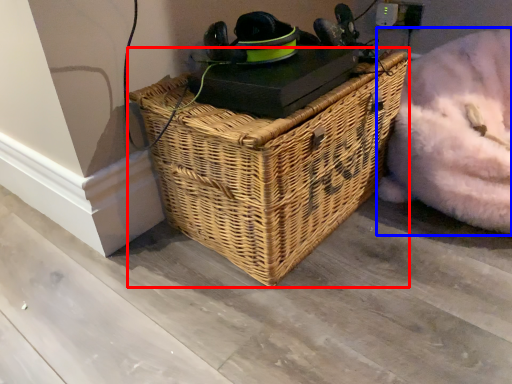
Question: Which of the following is the farthest to the observer, picnic basket (highlighted by a red box) or bean bag chair (highlighted by a blue box)?

Choices:
 (A) picnic basket
 (B) bean bag chair

Answer: (B)